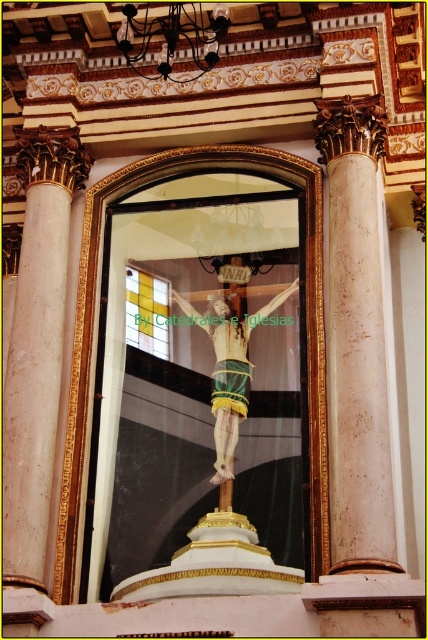
Question: Can you confirm if white marble column at center is bigger than polished gold crucifix at center?

Choices:
 (A) no
 (B) yes

Answer: (B)

Question: Which object is closer to the camera taking this photo?

Choices:
 (A) white marble column at right
 (B) white marble column at center

Answer: (B)

Question: Is transparent glass crucifix at center positioned in front of white marble column at center?

Choices:
 (A) no
 (B) yes

Answer: (A)

Question: Among these objects, which one is nearest to the camera?

Choices:
 (A) white marble column at right
 (B) transparent glass crucifix at center

Answer: (A)

Question: Does white marble column at right come behind polished gold crucifix at center?

Choices:
 (A) yes
 (B) no

Answer: (B)

Question: Which point is farther to the camera?

Choices:
 (A) polished gold crucifix at center
 (B) white marble column at right
 (C) transparent glass crucifix at center

Answer: (A)